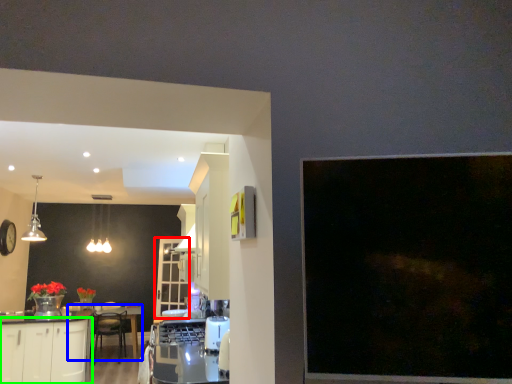
Question: Which object is the farthest from glass door (highlighted by a red box)? Choose among these: round table (highlighted by a blue box) or cabinetry (highlighted by a green box).

Choices:
 (A) round table
 (B) cabinetry

Answer: (B)